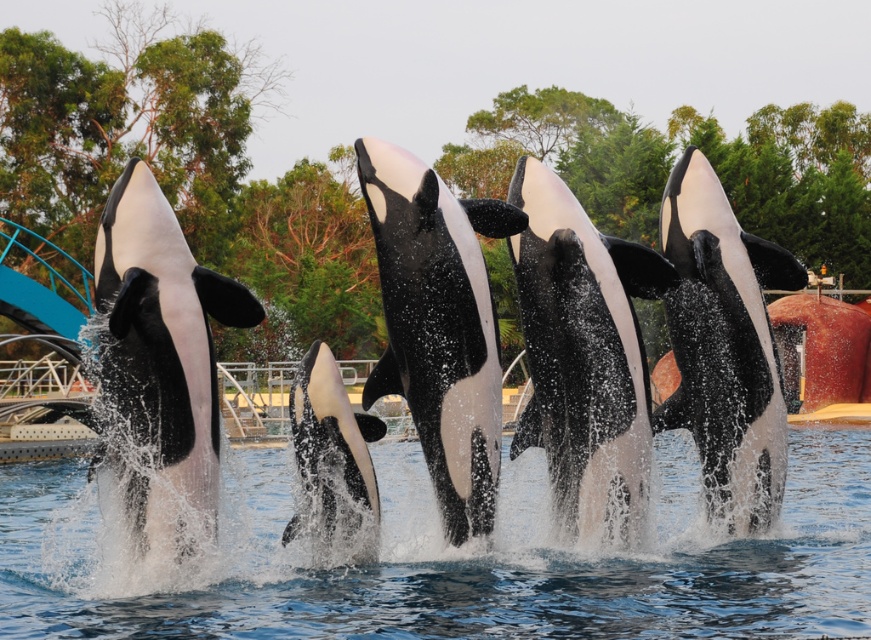
You are standing at the edge of the marine park pool watching the orcas perform. You notice two points in the water where the orcas will land. Point A is at coordinates point (440, 428) and Point B is at point (755, 506). Which point is closer to you?

Point A at point (440, 428) is closer to the viewer than point B at point (755, 506).